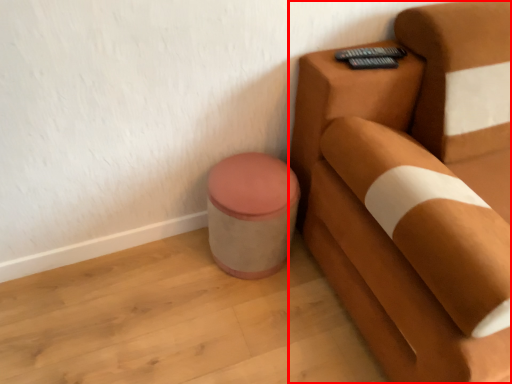
Question: From the image's perspective, what is the correct spatial positioning of furniture (annotated by the red box) in reference to potty?

Choices:
 (A) above
 (B) below

Answer: (A)